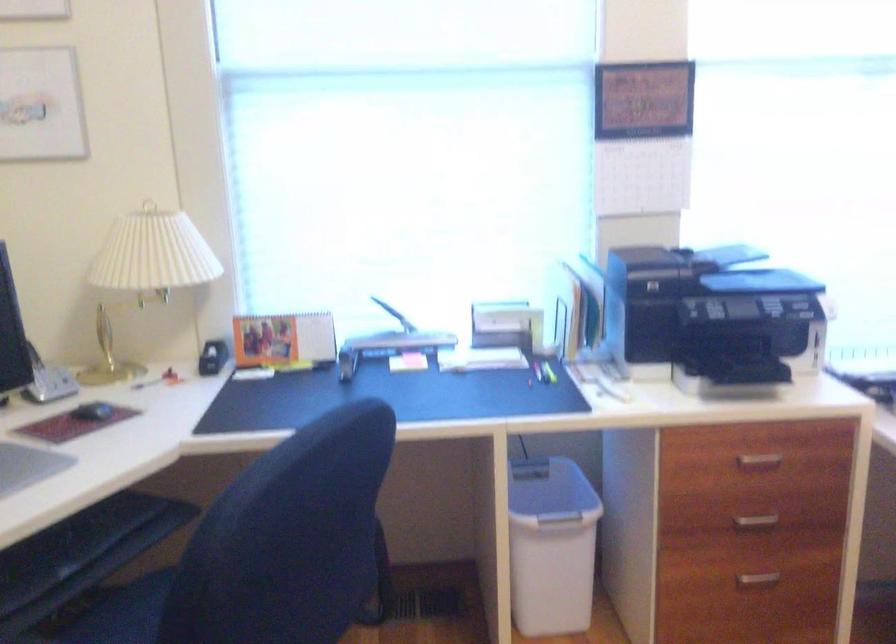
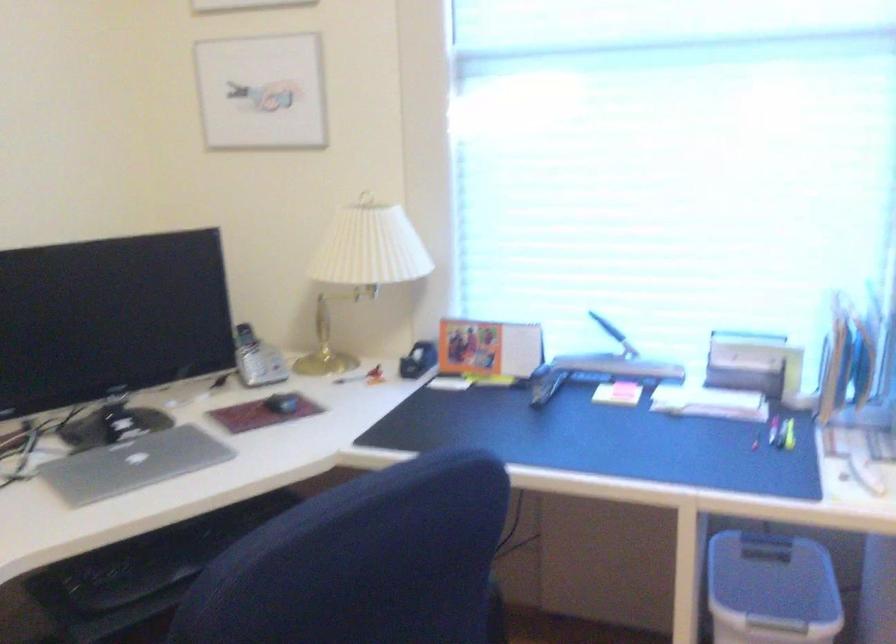
In the second image, find the point that corresponds to pixel 386 307 in the first image.

(607, 327)